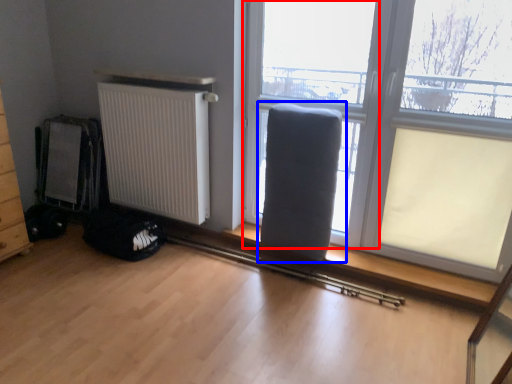
Question: Which point is further to the camera, window frame (highlighted by a red box) or armchair (highlighted by a blue box)?

Choices:
 (A) window frame
 (B) armchair

Answer: (B)